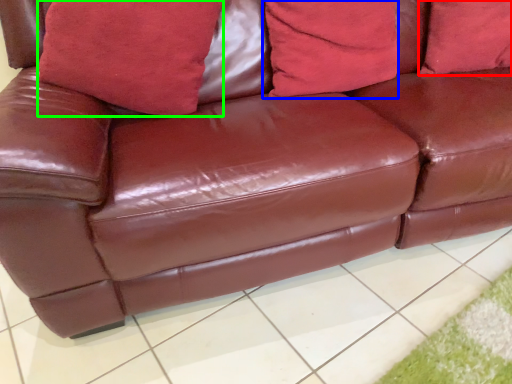
Question: Based on their relative distances, which object is farther from pillow (highlighted by a red box)? Choose from pillow (highlighted by a blue box) and pillow (highlighted by a green box).

Choices:
 (A) pillow
 (B) pillow

Answer: (B)